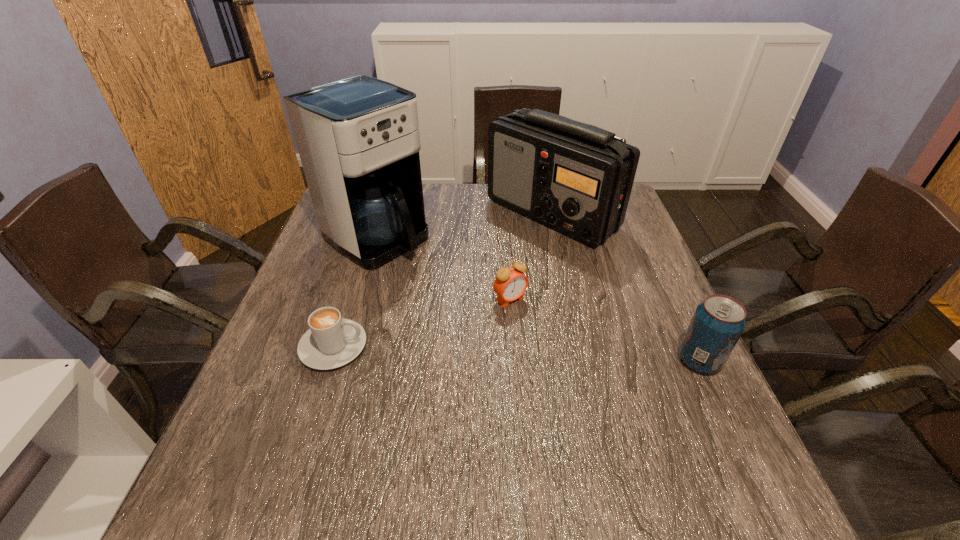
Locate an element on the screen. The height and width of the screenshot is (540, 960). the shortest object is located at coordinates (332, 341).

Where is `the third tallest object`? The image size is (960, 540). the third tallest object is located at coordinates (718, 322).

You are a GUI agent. You are given a task and a screenshot of the screen. Output one action in this format:
    pyautogui.click(x=<x>, y=<y>)
    Task: Click on the rightmost object
    Image resolution: width=960 pixels, height=540 pixels.
    Given the screenshot: What is the action you would take?
    pyautogui.click(x=718, y=322)

The width and height of the screenshot is (960, 540). Identify the location of coffee maker. (358, 139).

Find the location of a particular element. the second tallest object is located at coordinates (576, 178).

Locate an element on the screen. The image size is (960, 540). alarm clock is located at coordinates (510, 284).

Locate an element on the screen. This screenshot has height=540, width=960. the fourth tallest object is located at coordinates (510, 284).

I want to click on free space located 0.320m to the right of the cappuccino, so click(513, 346).

At what (x,y) coordinates should I click in order to perform the action: click on free location located on the back of the rightmost object. Please return your answer as a coordinate pair (x, y). Looking at the image, I should click on pyautogui.click(x=645, y=245).

The height and width of the screenshot is (540, 960). What are the coordinates of `free space located 0.080m on the front panel of the coffee maker` in the screenshot? It's located at (430, 272).